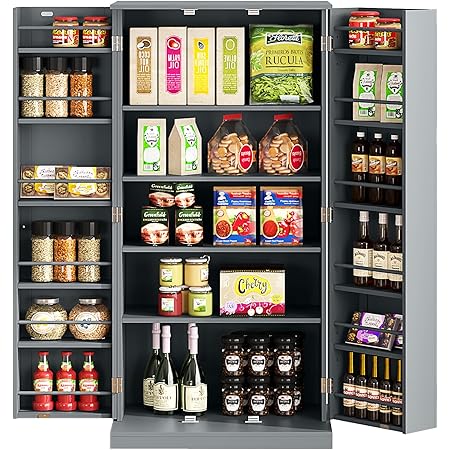
At what (x,y) coordinates should I click in order to perform the action: click on things on top shelf. Please return your answer as a coordinate pair (x, y). The height and width of the screenshot is (450, 450). Looking at the image, I should click on (60, 27), (89, 36), (149, 55), (171, 56), (201, 57), (233, 56), (283, 56), (359, 33), (387, 35).